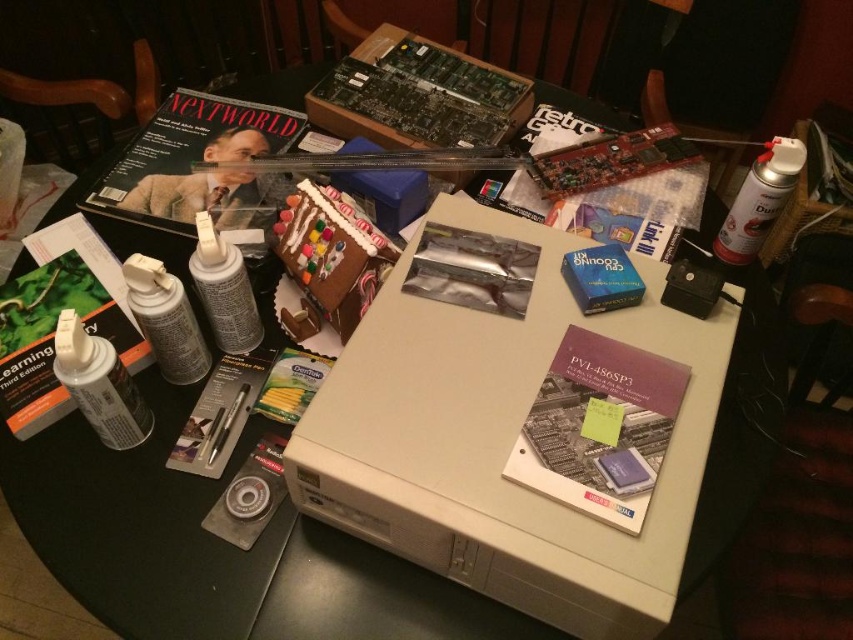
Question: Estimate the real-world distances between objects in this image. Which object is farther from the purple paper at center?

Choices:
 (A) metallic silver pen at lower center
 (B) matte white spray can at left
 (C) white matte spray can at upper right

Answer: (B)

Question: Which of these objects is positioned farthest from the purple paper at center?

Choices:
 (A) white matte spray can at center-left
 (B) white matte spray can at lower left
 (C) matte white spray can at left

Answer: (B)

Question: Which of the following is the closest to the observer?

Choices:
 (A) (631, 458)
 (B) (576, 202)

Answer: (A)

Question: Can you confirm if purple paper at center is positioned above white matte spray can at lower left?

Choices:
 (A) no
 (B) yes

Answer: (A)

Question: Does white matte book at left appear on the right side of metallic silver pen at lower center?

Choices:
 (A) yes
 (B) no

Answer: (B)

Question: Does matte black magazine at upper center have a lesser width compared to matte plastic magazine at center?

Choices:
 (A) no
 (B) yes

Answer: (A)